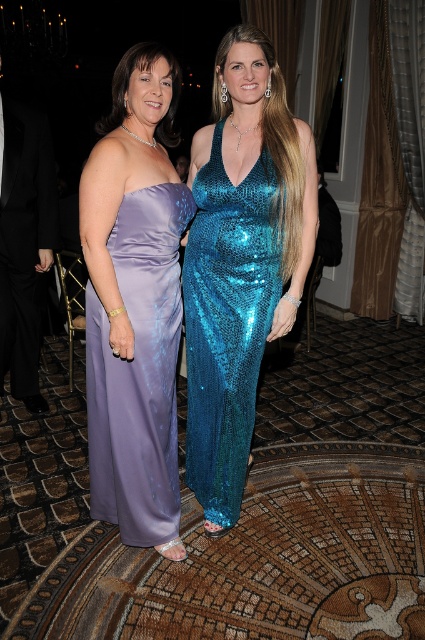
Which is below, satin dress at center or shiny teal sequined dress at center?

satin dress at center is lower down.

The width and height of the screenshot is (425, 640). What do you see at coordinates (138, 371) in the screenshot? I see `satin dress at center` at bounding box center [138, 371].

Identify the location of satin dress at center. Image resolution: width=425 pixels, height=640 pixels. (138, 371).